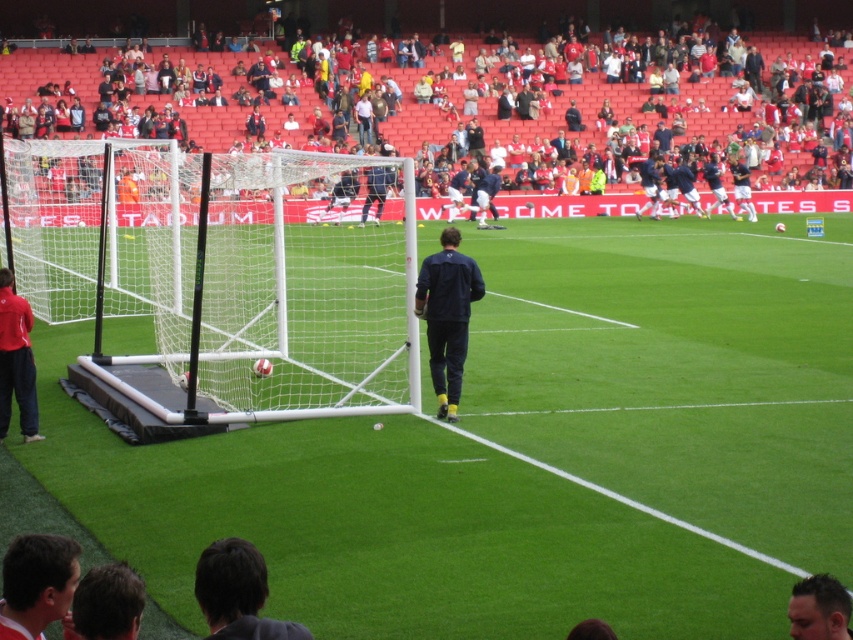
Question: Among these points, which one is farthest from the camera?

Choices:
 (A) [326, 241]
 (B) [20, 323]
 (C) [225, 593]

Answer: (A)

Question: Can you confirm if dark brown hair at lower left is smaller than red fabric jacket at lower left?

Choices:
 (A) no
 (B) yes

Answer: (B)

Question: Does dark brown hair at lower left lie behind dark brown hair at lower right?

Choices:
 (A) yes
 (B) no

Answer: (B)

Question: Among these points, which one is farthest from the camera?

Choices:
 (A) (465, 289)
 (B) (824, 602)

Answer: (A)

Question: Can you confirm if white synthetic turf at center is wider than red fabric seats at upper center?

Choices:
 (A) yes
 (B) no

Answer: (B)

Question: Which of the following is the farthest from the observer?

Choices:
 (A) (13, 337)
 (B) (206, 588)

Answer: (A)